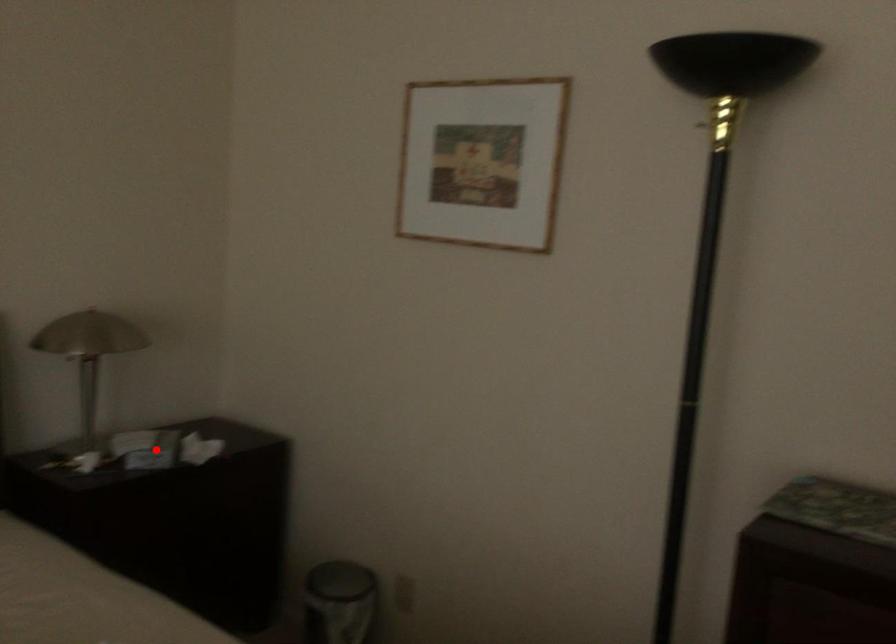
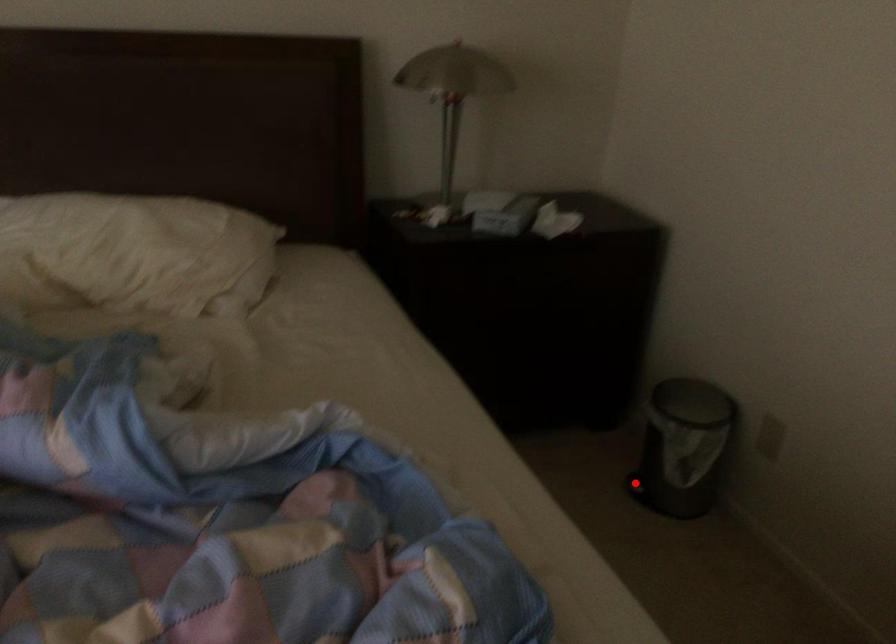
I am providing you with two images of the same scene from different viewpoints. A red point is marked on the first image and another point is marked on the second image. Does the point marked in image1 correspond to the same location as the one in image2?

No